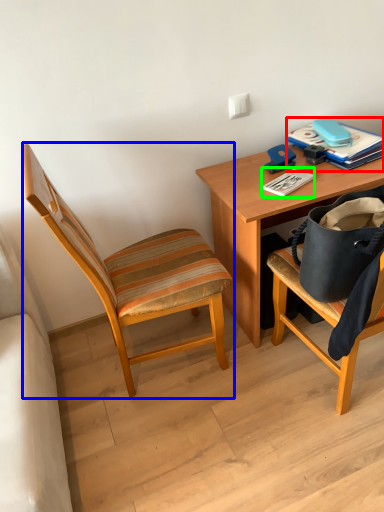
Question: Which object is positioned farthest from paperback book (highlighted by a red box)? Select from chair (highlighted by a blue box) and paperback book (highlighted by a green box).

Choices:
 (A) chair
 (B) paperback book

Answer: (A)